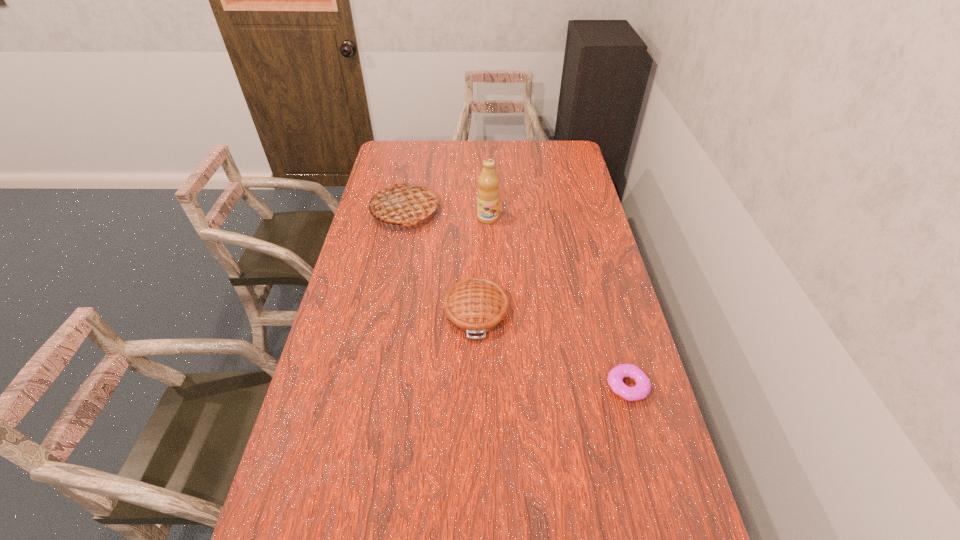
Find the location of a particular element. Image resolution: width=960 pixels, height=540 pixels. free spot located on the left of the rightmost object is located at coordinates (466, 386).

Find the location of a particular element. object that is at the left edge is located at coordinates (404, 203).

Identify the location of object located in the right edge section of the desktop. (615, 377).

You are a GUI agent. You are given a task and a screenshot of the screen. Output one action in this format:
    pyautogui.click(x=<x>, y=<y>)
    Task: Click on the blank space at the far edge of the desktop
    The width and height of the screenshot is (960, 540).
    Given the screenshot: What is the action you would take?
    pyautogui.click(x=433, y=147)

Locate an element on the screen. This screenshot has height=540, width=960. vacant point at the left edge is located at coordinates (362, 277).

Find the location of a particular element. The width and height of the screenshot is (960, 540). vacant space at the right edge of the desktop is located at coordinates (590, 221).

Image resolution: width=960 pixels, height=540 pixels. I want to click on free space at the far right corner of the desktop, so point(550,149).

Identify the location of vacant space that's between the nearest object and the right pie. (552, 349).

Where is `unoccupied area between the doughnut and the taller pie`? unoccupied area between the doughnut and the taller pie is located at coordinates (516, 299).

At what (x,y) coordinates should I click in order to perform the action: click on free point between the rightmost object and the right pie. Please return your answer as a coordinate pair (x, y). Looking at the image, I should click on (552, 349).